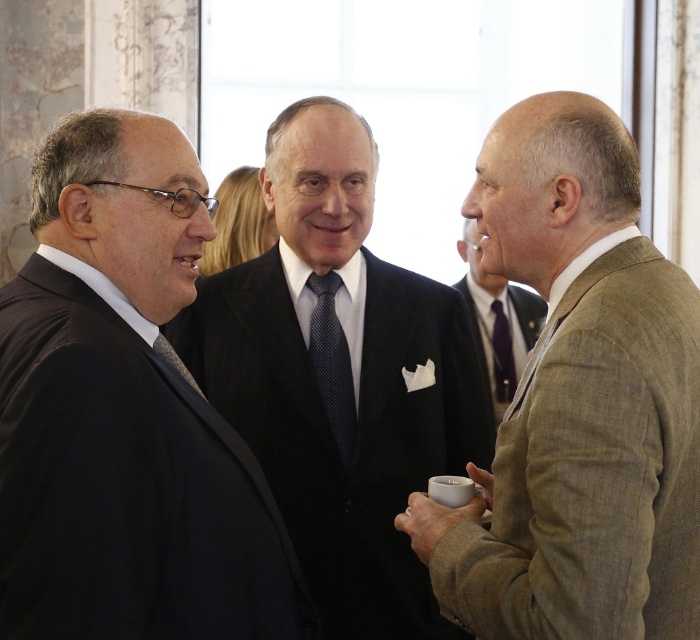
Looking at this image, you are standing in the room where the three men are talking. You need to place a small table between the two points labeled point (322, 368) and point (505, 339). Which point should the table be closer to to ensure it is in front of the other point?

The table should be closer to point (322, 368) because it is in front of point (505, 339).